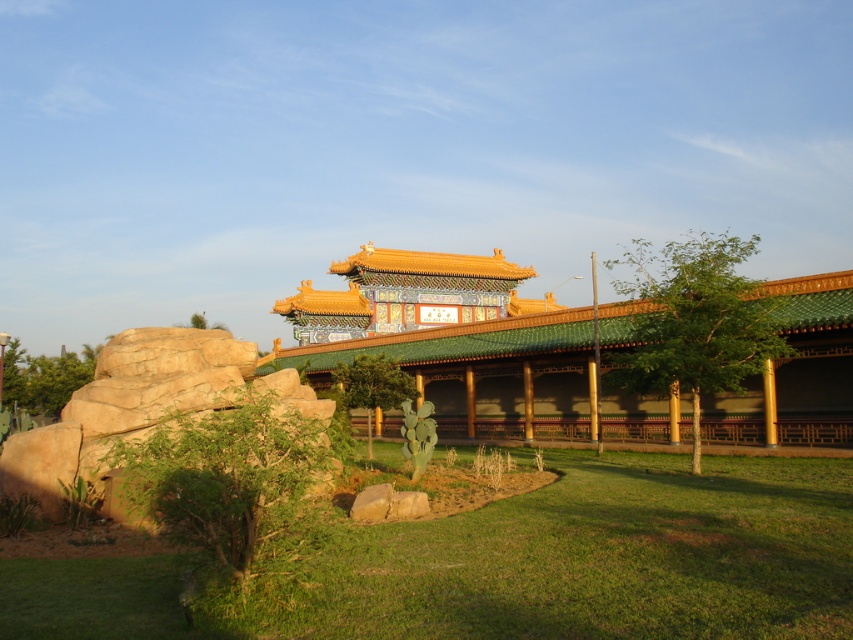
You are a visitor standing in front of the green glazed tile palace at center and the green leafy tree at left. Which object appears bigger in the scene?

The green glazed tile palace at center is larger in size compared to the green leafy tree at left, so it appears bigger.